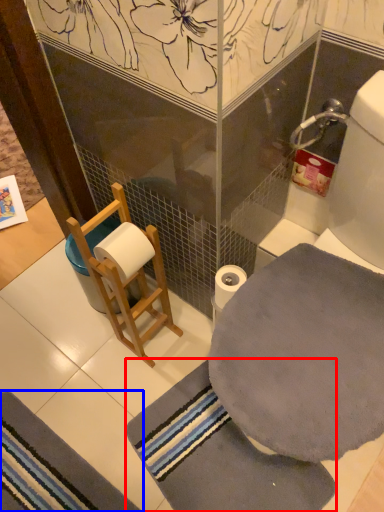
Question: Which of the following is the closest to the observer, bath towel (highlighted by a red box) or bath mat (highlighted by a blue box)?

Choices:
 (A) bath towel
 (B) bath mat

Answer: (A)